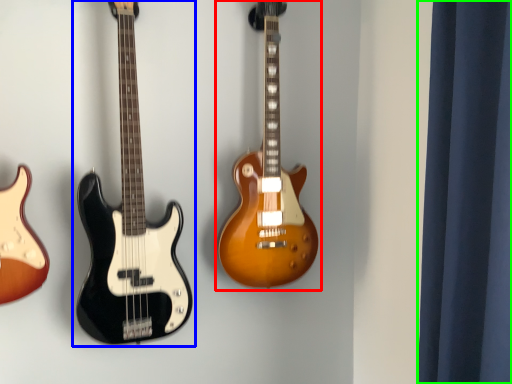
Question: Considering the real-world distances, which object is closest to guitar (highlighted by a red box)? guitar (highlighted by a blue box) or curtain (highlighted by a green box).

Choices:
 (A) guitar
 (B) curtain

Answer: (A)